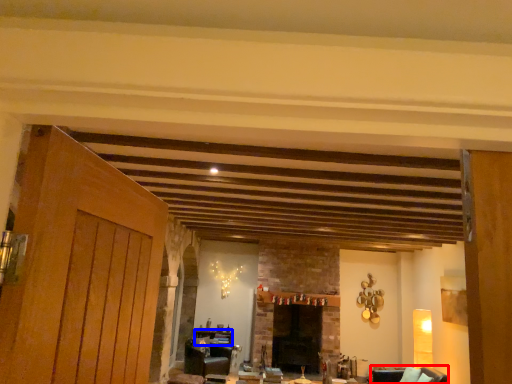
Question: Which object appears closest to the camera in this image, armchair (highlighted by a red box) or table (highlighted by a blue box)?

Choices:
 (A) armchair
 (B) table

Answer: (A)